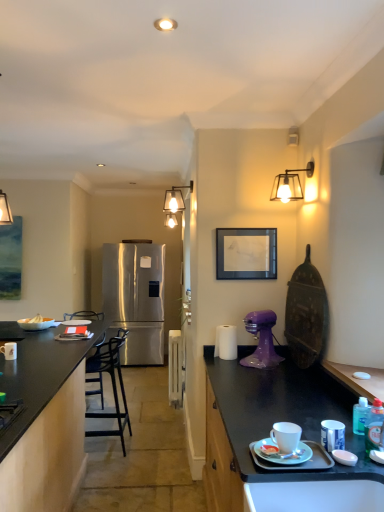
This screenshot has width=384, height=512. Describe the element at coordinates (246, 253) in the screenshot. I see `black matte picture frame at center` at that location.

Identify the location of black matte picture frame at center. (246, 253).

Measure the distance between black matte countertop at left and camera.

A distance of 1.63 meters exists between black matte countertop at left and camera.

The width and height of the screenshot is (384, 512). What do you see at coordinates (77, 322) in the screenshot?
I see `white glossy book at center, the second tableware when ordered from top to bottom` at bounding box center [77, 322].

In order to click on white glossy book at center, the second tableware when ordered from top to bottom in this screenshot , I will do `click(77, 322)`.

What do you see at coordinates (306, 314) in the screenshot? Image resolution: width=384 pixels, height=512 pixels. I see `wooden pizza peel at right` at bounding box center [306, 314].

This screenshot has width=384, height=512. I want to click on wooden pizza peel at right, so tap(306, 314).

You are a GUI agent. You are given a task and a screenshot of the screen. Output one action in this format:
    pyautogui.click(x=<x>, y=<y>)
    Task: Click on the matte glass lamp at center, the 2th lamp in the right-to-left sequence
    The image size is (384, 512).
    Given the screenshot: What is the action you would take?
    pyautogui.click(x=175, y=199)

The width and height of the screenshot is (384, 512). In order to click on white glossy coffee cup at left, the first coffee cup in the back-to-front sequence in this screenshot , I will do tap(9, 350).

What are the coordinates of `black matte picture frame at center` in the screenshot? It's located at (246, 253).

The image size is (384, 512). Identify the location of tableware below the white glossy mug at lower right, the 2th coffee cup viewed from the left (from a real-world perspective). (77, 322).

Is white glossy mug at lower right, the 2th coffee cup viewed from the left, facing towards white glossy book at center, the first tableware in the back-to-front sequence?

No, white glossy mug at lower right, the 2th coffee cup viewed from the left, is not oriented towards white glossy book at center, the first tableware in the back-to-front sequence.

Is white glossy mug at lower right, which ranks as the first coffee cup in right-to-left order, wider than white glossy book at center, positioned as the 1th tableware in left-to-right order?

Incorrect, the width of white glossy mug at lower right, which ranks as the first coffee cup in right-to-left order, does not surpass that of white glossy book at center, positioned as the 1th tableware in left-to-right order.

Based on the photo, can you confirm if white glossy mug at lower right, which ranks as the first coffee cup in right-to-left order, is shorter than white glossy book at center, which is the second tableware in front-to-back order?

Incorrect, the height of white glossy mug at lower right, which ranks as the first coffee cup in right-to-left order, does not fall short of that of white glossy book at center, which is the second tableware in front-to-back order.

From the image's perspective, is metallic glass lampshade at upper right, which ranks as the first lamp in right-to-left order, positioned above or below porcelain saucer at lower right?

From the image's perspective, metallic glass lampshade at upper right, which ranks as the first lamp in right-to-left order, appears above porcelain saucer at lower right.

Is metallic glass lampshade at upper right, which is the second lamp in back-to-front order, facing away from porcelain saucer at lower right?

No, metallic glass lampshade at upper right, which is the second lamp in back-to-front order,'s orientation is not away from porcelain saucer at lower right.

Is metallic glass lampshade at upper right, which ranks as the first lamp in right-to-left order, far away from porcelain saucer at lower right?

Yes, metallic glass lampshade at upper right, which ranks as the first lamp in right-to-left order, and porcelain saucer at lower right are located far from each other.

How many degrees apart are the facing directions of white matte bowl at left and white matte bowl at left?

The angle between the facing direction of white matte bowl at left and the facing direction of white matte bowl at left is 3.55 degrees.

Based on the photo, could you tell me if white matte bowl at left is facing white matte bowl at left?

Yes, white matte bowl at left is aimed at white matte bowl at left.

Would you say white matte bowl at left is to the left or to the right of white matte bowl at left in the picture?

white matte bowl at left is to the left of white matte bowl at left.

Considering the relative sizes of white matte bowl at left and white matte bowl at left in the image provided, is white matte bowl at left wider than white matte bowl at left?

Correct, the width of white matte bowl at left exceeds that of white matte bowl at left.

Is purple plastic mixer at center-right inside porcelain saucer at lower right?

That's incorrect, purple plastic mixer at center-right is not inside porcelain saucer at lower right.

Based on the photo, looking at their sizes, would you say porcelain saucer at lower right is wider or thinner than purple plastic mixer at center-right?

porcelain saucer at lower right is thinner than purple plastic mixer at center-right.

From a real-world perspective, is porcelain saucer at lower right located higher than purple plastic mixer at center-right?

No, from a real-world perspective, porcelain saucer at lower right is not above purple plastic mixer at center-right.

Considering their positions, is porcelain saucer at lower right located in front of or behind purple plastic mixer at center-right?

Visually, porcelain saucer at lower right is located in front of purple plastic mixer at center-right.

From a real-world perspective, between wooden pizza peel at right and black matte countertop at left, who is vertically higher?

In real-world perspective, wooden pizza peel at right is above.

Considering the sizes of objects wooden pizza peel at right and black matte countertop at left in the image provided, who is shorter, wooden pizza peel at right or black matte countertop at left?

Standing shorter between the two is wooden pizza peel at right.

Considering the relative sizes of wooden pizza peel at right and black matte countertop at left in the image provided, is wooden pizza peel at right thinner than black matte countertop at left?

Indeed, wooden pizza peel at right has a lesser width compared to black matte countertop at left.

From the image's perspective, is wooden pizza peel at right beneath black matte countertop at left?

No.

Does black matte picture frame at center have a larger size compared to stainless steel refrigerator at center?

No, black matte picture frame at center is not bigger than stainless steel refrigerator at center.

Could you tell me if black matte picture frame at center is facing stainless steel refrigerator at center?

No, black matte picture frame at center is not aimed at stainless steel refrigerator at center.

From the image's perspective, which is below, black matte picture frame at center or stainless steel refrigerator at center?

stainless steel refrigerator at center is shown below in the image.

Is black metal bar stool at left to the right of white matte bowl at left from the viewer's perspective?

Indeed, black metal bar stool at left is positioned on the right side of white matte bowl at left.

Relative to white matte bowl at left, is black metal bar stool at left in front or behind?

black metal bar stool at left is positioned closer to the viewer than white matte bowl at left.

In the scene shown: Would you say black metal bar stool at left contains white matte bowl at left?

No.

Is black metal bar stool at left looking in the opposite direction of white matte bowl at left?

No, black metal bar stool at left's orientation is not away from white matte bowl at left.

The image size is (384, 512). Find the location of `tableware below the white glossy mug at lower right, the 2th coffee cup viewed from the left (from the image's perspective)`. tableware below the white glossy mug at lower right, the 2th coffee cup viewed from the left (from the image's perspective) is located at coordinates (77, 322).

You are a GUI agent. You are given a task and a screenshot of the screen. Output one action in this format:
    pyautogui.click(x=<x>, y=<y>)
    Task: Click on the saucer on the left of metallic glass lampshade at upper right, which is the 1th lamp from front to back
    
    Given the screenshot: What is the action you would take?
    pyautogui.click(x=281, y=454)

Based on their spatial positions, is matte glass lamp at center, the 1th lamp viewed from the left, or white glossy mug at lower right, the 2th coffee cup viewed from the left, closer to black matte picture frame at center?

white glossy mug at lower right, the 2th coffee cup viewed from the left, is closer to black matte picture frame at center.

Considering their positions, is metallic glass lampshade at upper right, which is the second lamp in back-to-front order, positioned further to white glossy mug at lower right, which appears as the 2th coffee cup when viewed from the back, than porcelain saucer at lower right?

The object further to white glossy mug at lower right, which appears as the 2th coffee cup when viewed from the back, is metallic glass lampshade at upper right, which is the second lamp in back-to-front order.

Looking at the image, which one is located further to purple plastic mixer at center-right, white glossy book at center, the first tableware in the back-to-front sequence, or white matte plate at right, which appears as the 1th tableware when viewed from the top?

Among the two, white glossy book at center, the first tableware in the back-to-front sequence, is located further to purple plastic mixer at center-right.

When comparing their distances from white matte plate at right, the second tableware in the left-to-right sequence, does white glossy book at center, the second tableware when ordered from top to bottom, or metallic glass lampshade at upper right, which is the 1th lamp from front to back, seem further?

white glossy book at center, the second tableware when ordered from top to bottom.

Estimate the real-world distances between objects in this image. Which object is closer to wooden pizza peel at right, porcelain saucer at lower right or stainless steel refrigerator at center?

porcelain saucer at lower right is closer to wooden pizza peel at right.

Estimate the real-world distances between objects in this image. Which object is closer to white matte bowl at left, purple plastic mixer at center-right or matte glass lamp at center, the 2th lamp in the right-to-left sequence?

purple plastic mixer at center-right is closer to white matte bowl at left.

Estimate the real-world distances between objects in this image. Which object is further from porcelain saucer at lower right, white glossy coffee cup at left, the first coffee cup in the back-to-front sequence, or black matte countertop at left?

Among the two, white glossy coffee cup at left, the first coffee cup in the back-to-front sequence, is located further to porcelain saucer at lower right.

From the picture: Estimate the real-world distances between objects in this image. Which object is closer to white glossy mug at lower right, the 2th coffee cup viewed from the left, white glossy coffee cup at left, the 1th coffee cup viewed from the left, or purple plastic mixer at center-right?

purple plastic mixer at center-right.

Locate an element on the screen. picture frame between white glossy coffee cup at left, the 2th coffee cup in the right-to-left sequence, and metallic glass lampshade at upper right, which is the second lamp in back-to-front order, from left to right is located at coordinates (246, 253).

This screenshot has width=384, height=512. I want to click on picture frame between white matte bowl at left and metallic glass lampshade at upper right, which is the second lamp in back-to-front order, from left to right, so click(x=246, y=253).

Find the location of a particular element. The image size is (384, 512). chair between white matte bowl at left and metallic glass lampshade at upper right, which is the second lamp in back-to-front order, in the horizontal direction is located at coordinates (112, 384).

The image size is (384, 512). Find the location of `tableware located between purple plastic mixer at center-right and stainless steel refrigerator at center in the depth direction`. tableware located between purple plastic mixer at center-right and stainless steel refrigerator at center in the depth direction is located at coordinates pyautogui.click(x=77, y=322).